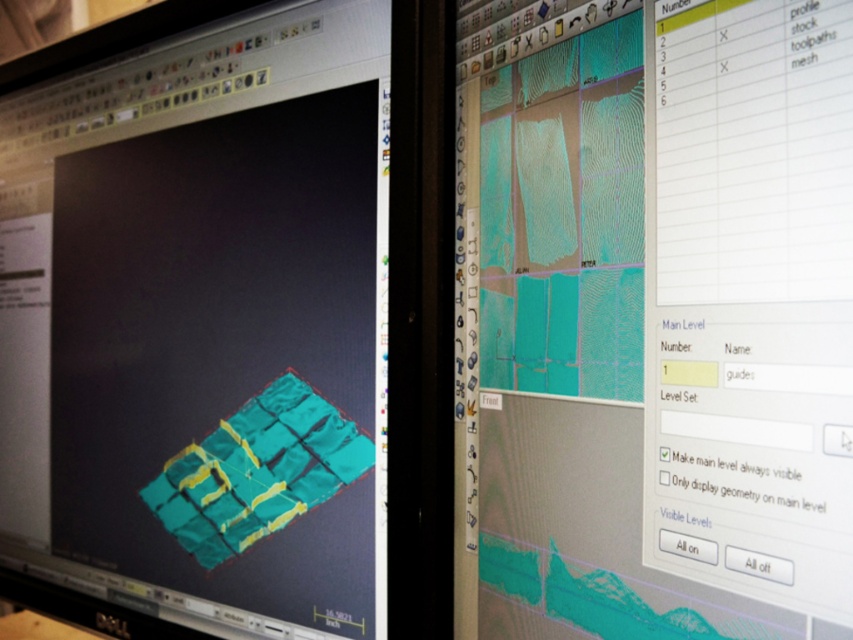
You are a designer working on a 3D modeling project. You have two objects displayed on your monitors. The teal matte cube at center and the teal matte mesh at center. Which object is taller?

The teal matte cube at center is taller than the teal matte mesh at center.

You are a designer who needs to adjust the position of the teal matte cube at center. If your hand is 25 inches away from the monitor, can you reach the cube by moving your hand forward without moving the monitor?

The teal matte cube at center is 30.61 inches away from the viewer. Since your hand is only 25 inches away from the monitor, you cannot reach the cube by moving your hand forward without moving the monitor.